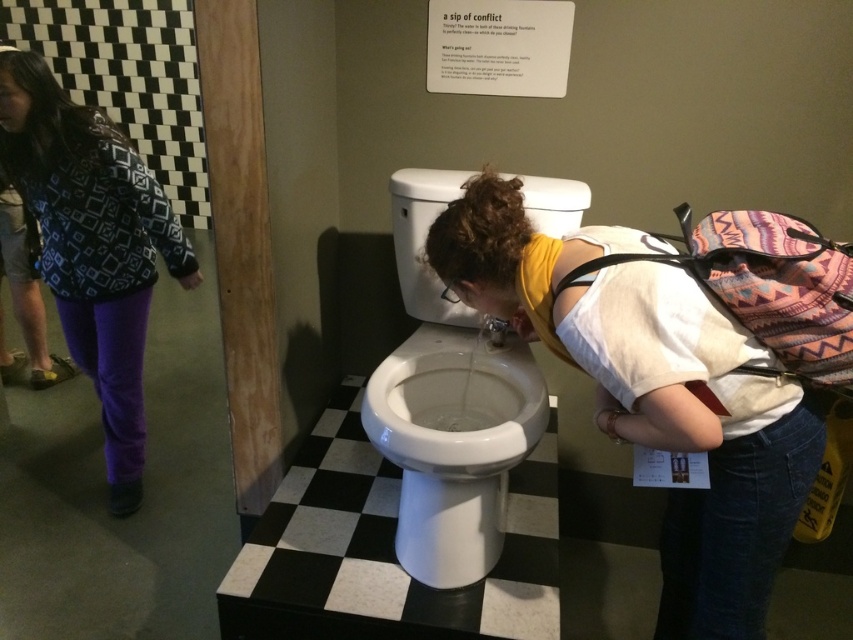
What do you see at coordinates (654, 392) in the screenshot? The image size is (853, 640). I see `white glossy toilet at center` at bounding box center [654, 392].

From the picture: Does white glossy toilet at center appear over patterned fabric jacket at left?

Actually, white glossy toilet at center is below patterned fabric jacket at left.

Is point (573, 284) farther from camera compared to point (146, 285)?

No, (573, 284) is closer to viewer.

This screenshot has height=640, width=853. Identify the location of white glossy toilet at center. (654, 392).

Is white glossy toilet at center behind white glossy toilet bowl at center?

That is False.

Which of these two, white glossy toilet at center or white glossy toilet bowl at center, stands shorter?

white glossy toilet bowl at center is shorter.

Between point (611, 307) and point (502, 518), which one is positioned in front?

Point (611, 307) is in front.

At what (x,y) coordinates should I click in order to perform the action: click on white glossy toilet at center. Please return your answer as a coordinate pair (x, y). The height and width of the screenshot is (640, 853). Looking at the image, I should click on (654, 392).

Is white glossy toilet bowl at center in front of patterned fabric jacket at left?

Yes, white glossy toilet bowl at center is in front of patterned fabric jacket at left.

Is point (550, 204) farther from viewer compared to point (65, 333)?

No, (550, 204) is in front of (65, 333).

In order to click on white glossy toilet bowl at center in this screenshot , I will do `click(448, 406)`.